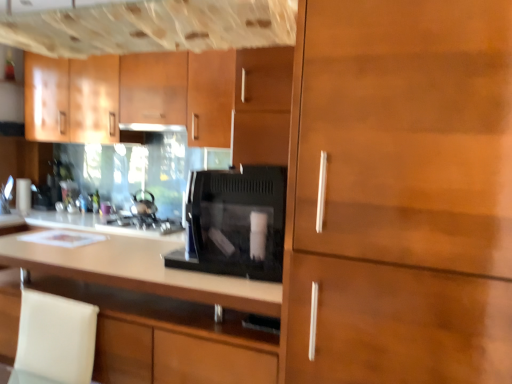
Question: Could matte wood cabinets at upper left, which is the third cabinetry in front-to-back order, be considered to be inside shiny metallic kettle at center?

Choices:
 (A) yes
 (B) no

Answer: (B)

Question: Is shiny metallic kettle at center facing towards matte wood cabinets at upper left, which appears as the first cabinetry when viewed from the back?

Choices:
 (A) no
 (B) yes

Answer: (A)

Question: Is shiny metallic kettle at center not close to matte wood cabinets at upper left, which is the third cabinetry in front-to-back order?

Choices:
 (A) no
 (B) yes

Answer: (A)

Question: From a real-world perspective, is shiny metallic kettle at center positioned under matte wood cabinets at upper left, which is the third cabinetry in front-to-back order, based on gravity?

Choices:
 (A) no
 (B) yes

Answer: (B)

Question: Is shiny metallic kettle at center taller than matte wood cabinets at upper left, which is the third cabinetry in front-to-back order?

Choices:
 (A) no
 (B) yes

Answer: (A)

Question: Considering the positions of shiny metallic kettle at center and matte wood cabinets at upper left, which appears as the first cabinetry when viewed from the back, in the image, is shiny metallic kettle at center taller or shorter than matte wood cabinets at upper left, which appears as the first cabinetry when viewed from the back,?

Choices:
 (A) tall
 (B) short

Answer: (B)

Question: Is shiny metallic kettle at center to the left or to the right of matte wood cabinets at upper left, which appears as the first cabinetry when viewed from the back, in the image?

Choices:
 (A) left
 (B) right

Answer: (B)

Question: From the image's perspective, is shiny metallic kettle at center positioned above or below matte wood cabinets at upper left, which appears as the first cabinetry when viewed from the back?

Choices:
 (A) below
 (B) above

Answer: (A)

Question: Is shiny metallic kettle at center in front of or behind matte wood cabinets at upper left, which appears as the first cabinetry when viewed from the back, in the image?

Choices:
 (A) front
 (B) behind

Answer: (B)

Question: Would you say shiny metallic kettle at center is inside or outside matte black exhaust hood at upper center?

Choices:
 (A) outside
 (B) inside

Answer: (A)

Question: In the image, is shiny metallic kettle at center positioned in front of or behind matte black exhaust hood at upper center?

Choices:
 (A) front
 (B) behind

Answer: (B)

Question: From the image's perspective, is shiny metallic kettle at center above or below matte black exhaust hood at upper center?

Choices:
 (A) below
 (B) above

Answer: (A)

Question: From their relative heights in the image, would you say shiny metallic kettle at center is taller or shorter than matte black exhaust hood at upper center?

Choices:
 (A) short
 (B) tall

Answer: (B)

Question: From the image's perspective, relative to matte wood cabinets at upper left, which is the third cabinetry in front-to-back order, is matte black exhaust hood at upper center above or below?

Choices:
 (A) below
 (B) above

Answer: (A)

Question: From a real-world perspective, relative to matte wood cabinets at upper left, which appears as the first cabinetry when viewed from the back, is matte black exhaust hood at upper center vertically above or below?

Choices:
 (A) above
 (B) below

Answer: (B)